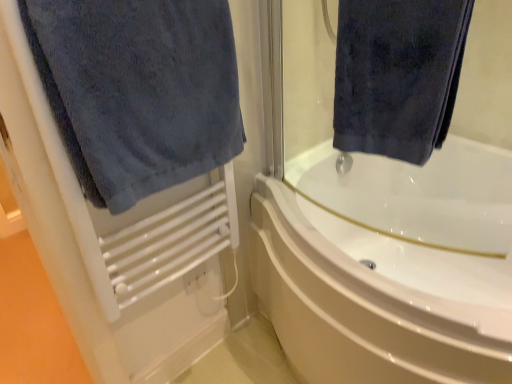
Question: From a real-world perspective, is dark blue velvety towel at upper right, the first towel in the right-to-left sequence, physically located above or below dark blue towel at left, arranged as the 2th towel when viewed from the right?

Choices:
 (A) below
 (B) above

Answer: (B)

Question: Would you say dark blue velvety towel at upper right, the first towel in the right-to-left sequence, is inside or outside dark blue towel at left, arranged as the 2th towel when viewed from the right?

Choices:
 (A) outside
 (B) inside

Answer: (A)

Question: Based on their relative distances, which object is farther from the dark blue towel at left, which is counted as the 1th towel, starting from the left?

Choices:
 (A) white glossy bathtub at center
 (B) dark blue velvety towel at upper right, the second towel in the left-to-right sequence

Answer: (A)

Question: Estimate the real-world distances between objects in this image. Which object is farther from the white glossy bathtub at center?

Choices:
 (A) dark blue velvety towel at upper right, the second towel in the left-to-right sequence
 (B) dark blue towel at left, which is counted as the 1th towel, starting from the left

Answer: (B)